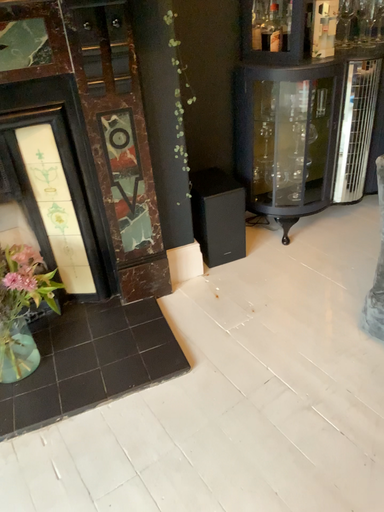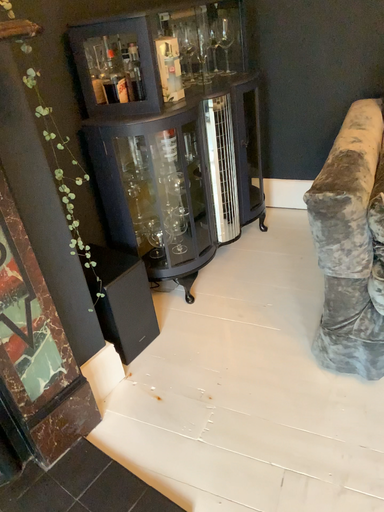
Question: How did the camera likely rotate when shooting the video?

Choices:
 (A) rotated upward
 (B) rotated downward

Answer: (A)